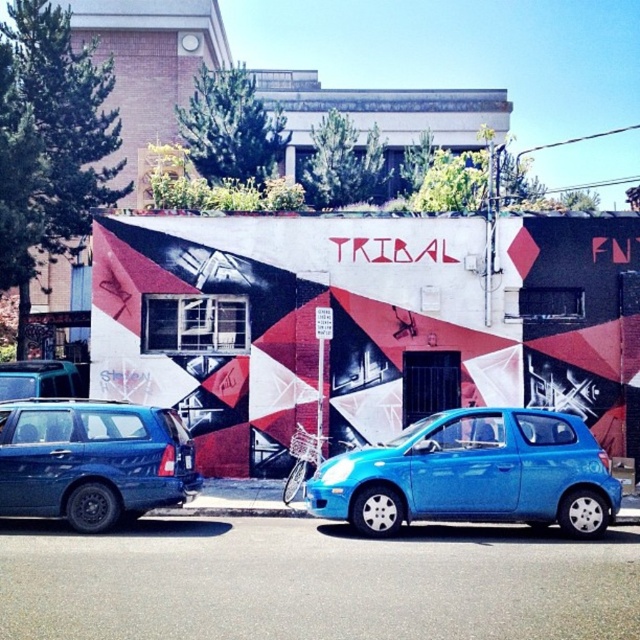
Question: Can you confirm if metallic blue hatchback at center is thinner than metallic blue suv at left?

Choices:
 (A) no
 (B) yes

Answer: (A)

Question: Does metallic blue hatchback at center have a lesser width compared to metallic blue suv at left?

Choices:
 (A) yes
 (B) no

Answer: (B)

Question: Which of the following is the closest to the observer?

Choices:
 (A) (580, 426)
 (B) (128, 477)

Answer: (B)

Question: Does metallic blue hatchback at center have a lesser width compared to metallic blue suv at left?

Choices:
 (A) yes
 (B) no

Answer: (B)

Question: Which point appears closest to the camera in this image?

Choices:
 (A) (349, 509)
 (B) (166, 416)

Answer: (A)

Question: Which of the following is the farthest from the observer?

Choices:
 (A) (545, 436)
 (B) (86, 531)

Answer: (A)